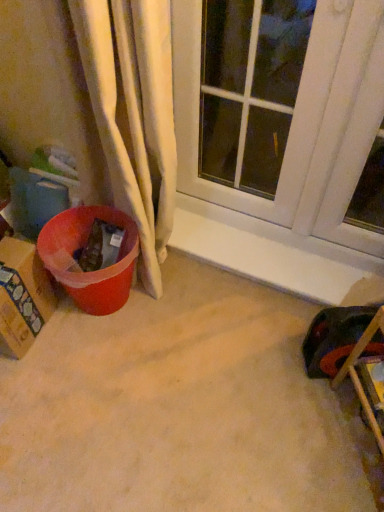
You are a GUI agent. You are given a task and a screenshot of the screen. Output one action in this format:
    pyautogui.click(x=<x>, y=<y>)
    Task: Click on the vacant space to the right of cardboard box at left
    This screenshot has height=512, width=384.
    Given the screenshot: What is the action you would take?
    pyautogui.click(x=67, y=344)